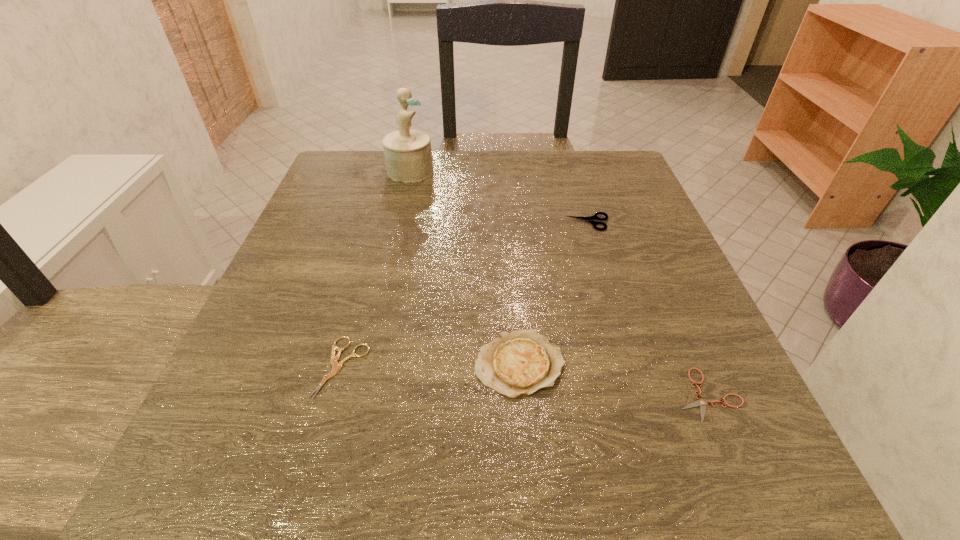
Find the location of `the tallest object`. the tallest object is located at coordinates (408, 156).

The height and width of the screenshot is (540, 960). Identify the location of the farthest object. (408, 156).

At what (x,y) coordinates should I click in order to perform the action: click on the third object from left to right. Please return your answer as a coordinate pair (x, y). The height and width of the screenshot is (540, 960). Looking at the image, I should click on (516, 363).

At what (x,y) coordinates should I click in order to perform the action: click on the second tallest object. Please return your answer as a coordinate pair (x, y). The width and height of the screenshot is (960, 540). Looking at the image, I should click on (516, 363).

What are the coordinates of `the fourth nearest object` in the screenshot? It's located at (591, 219).

This screenshot has width=960, height=540. In order to click on the tallest shears in this screenshot , I will do `click(591, 219)`.

I want to click on the second shortest shears, so click(x=336, y=366).

You are a GUI agent. You are given a task and a screenshot of the screen. Output one action in this format:
    pyautogui.click(x=<x>, y=<y>)
    Task: Click on the fourth tallest object
    
    Given the screenshot: What is the action you would take?
    pyautogui.click(x=336, y=366)

The width and height of the screenshot is (960, 540). What are the coordinates of `the shortest object` in the screenshot? It's located at (700, 402).

I want to click on the rightmost object, so click(x=700, y=402).